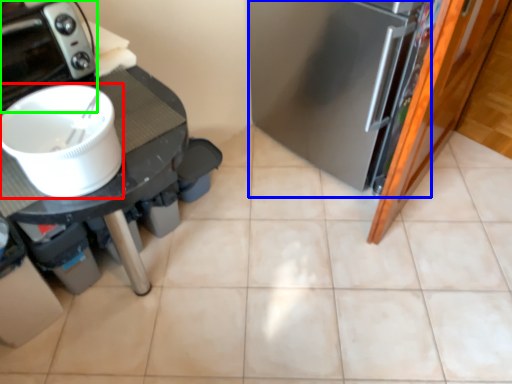
Question: Which object is the farthest from kitchen appliance (highlighted by a red box)? Choose among these: fridge (highlighted by a blue box) or home appliance (highlighted by a green box).

Choices:
 (A) fridge
 (B) home appliance

Answer: (A)